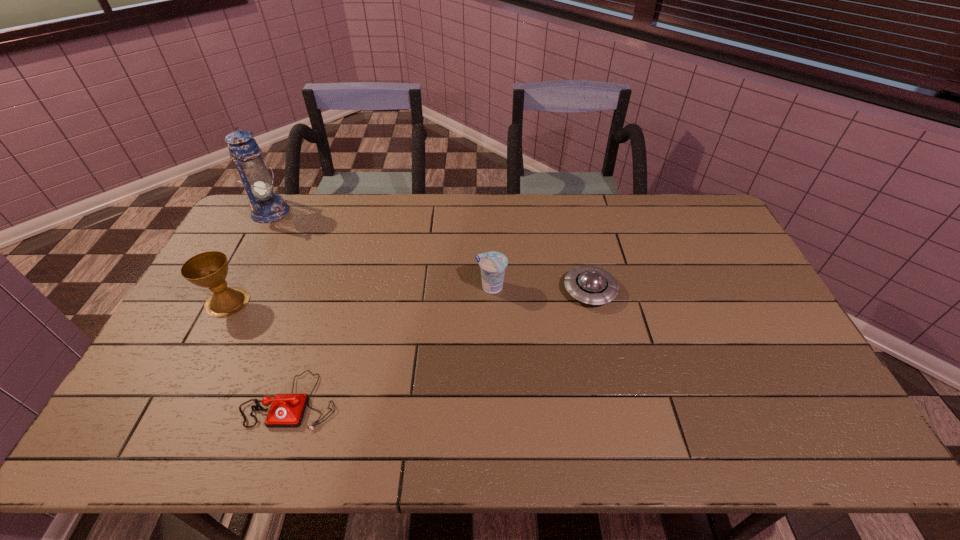
Image resolution: width=960 pixels, height=540 pixels. Find the location of `free space at the far right corner of the desktop`. free space at the far right corner of the desktop is located at coordinates (675, 210).

Where is `free space between the telephone and the saucer`? The image size is (960, 540). free space between the telephone and the saucer is located at coordinates (441, 345).

You are a GUI agent. You are given a task and a screenshot of the screen. Output one action in this format:
    pyautogui.click(x=<x>, y=<y>)
    Task: Click on the vacant space that is in between the third object from left to right and the saucer
    Image resolution: width=960 pixels, height=540 pixels.
    Given the screenshot: What is the action you would take?
    coord(441,345)

Image resolution: width=960 pixels, height=540 pixels. What are the coordinates of `empty location between the telephone and the rightmost object` in the screenshot? It's located at tap(441, 345).

Locate an element on the screen. empty location between the farthest object and the saucer is located at coordinates (430, 251).

I want to click on vacant area that lies between the chalice and the third object from left to right, so click(x=259, y=351).

Where is `empty space that is in between the tallest object and the fourth shortest object`? empty space that is in between the tallest object and the fourth shortest object is located at coordinates (249, 256).

Find the location of a particular element. This screenshot has height=540, width=960. free point between the third object from left to right and the rightmost object is located at coordinates (441, 345).

I want to click on empty location between the nearest object and the rightmost object, so click(441, 345).

The image size is (960, 540). I want to click on vacant space that is in between the chalice and the nearest object, so click(259, 351).